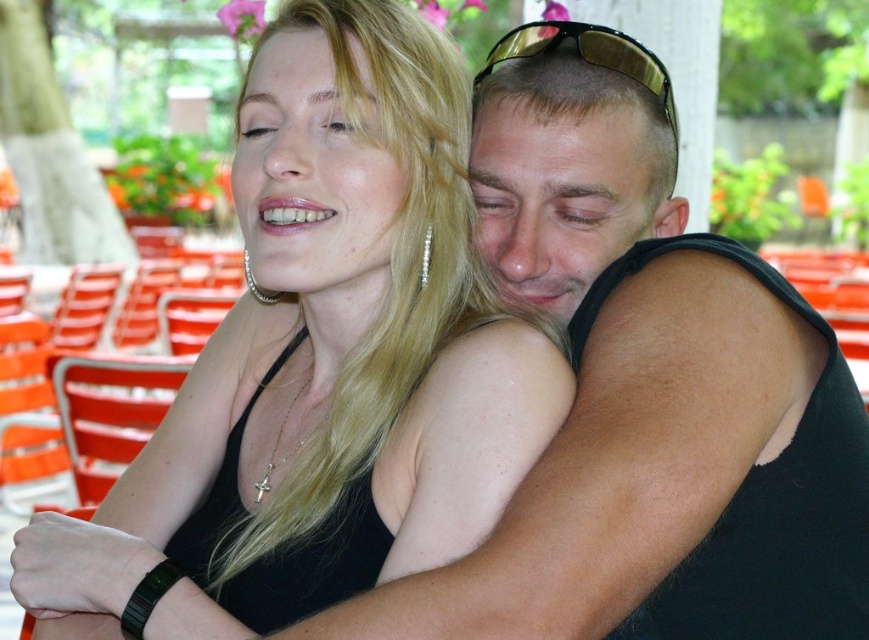
Question: Does black matte tank top at center lie behind gold reflective sunglasses at upper center?

Choices:
 (A) yes
 (B) no

Answer: (B)

Question: Considering the relative positions of black matte tank top at center and gold reflective sunglasses at upper center in the image provided, where is black matte tank top at center located with respect to gold reflective sunglasses at upper center?

Choices:
 (A) right
 (B) left

Answer: (B)

Question: Which point is closer to the camera taking this photo?

Choices:
 (A) (580, 42)
 (B) (377, 4)

Answer: (B)

Question: Which object is closer to the camera taking this photo?

Choices:
 (A) gold reflective sunglasses at upper center
 (B) black matte tank top at center

Answer: (B)

Question: Which point appears closest to the camera in this image?

Choices:
 (A) (648, 77)
 (B) (432, 44)

Answer: (B)

Question: Is black matte tank top at center positioned in front of gold reflective sunglasses at upper center?

Choices:
 (A) yes
 (B) no

Answer: (A)